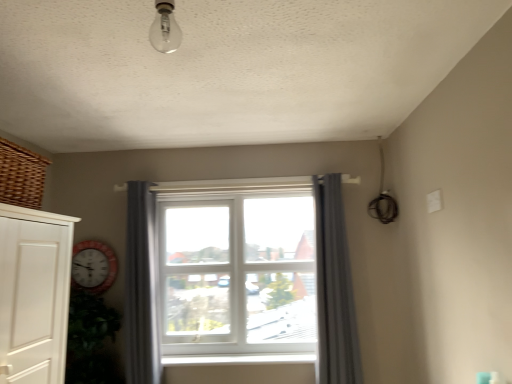
What is the approximate height of white plastic window at center?

3.56 feet.

I want to click on white wooden clock at left, so click(x=93, y=266).

The height and width of the screenshot is (384, 512). What do you see at coordinates (142, 287) in the screenshot? I see `gray fabric curtain at center, which is counted as the first curtain, starting from the left` at bounding box center [142, 287].

What is the approximate height of gray fabric curtain at center, which is counted as the first curtain, starting from the left?

It is 3.90 feet.

Measure the distance between point (15,178) and camera.

Point (15,178) and camera are 1.53 meters apart from each other.

Where is `clear glass bulb at upper center`? This screenshot has height=384, width=512. clear glass bulb at upper center is located at coordinates (165, 28).

In the scene shown: Considering the sizes of objects gray fabric curtain at center, arranged as the 2th curtain when viewed from the left, and white plastic window at center in the image provided, who is wider, gray fabric curtain at center, arranged as the 2th curtain when viewed from the left, or white plastic window at center?

With larger width is white plastic window at center.

From a real-world perspective, between gray fabric curtain at center, arranged as the 2th curtain when viewed from the left, and white plastic window at center, who is vertically higher?

From a 3D spatial view, white plastic window at center is above.

Which is behind, point (318, 372) or point (143, 280)?

The point (143, 280) is farther.

From the picture: Can you confirm if clear glass bulb at upper center is taller than gray fabric curtain at center, arranged as the 2th curtain when viewed from the left?

No.

Can we say clear glass bulb at upper center lies outside gray fabric curtain at center, the first curtain from the right?

clear glass bulb at upper center lies outside gray fabric curtain at center, the first curtain from the right,'s area.

Identify the location of light fixture on the left of gray fabric curtain at center, arranged as the 2th curtain when viewed from the left. Image resolution: width=512 pixels, height=384 pixels. (165, 28).

How many degrees apart are the facing directions of clear glass bulb at upper center and gray fabric curtain at center, the first curtain from the right?

7.7 degrees.

From a real-world perspective, is gray fabric curtain at center, which is counted as the first curtain, starting from the left, located higher than white plastic window sill at center?

Yes, from a real-world perspective, gray fabric curtain at center, which is counted as the first curtain, starting from the left, is on top of white plastic window sill at center.

Is white plastic window sill at center inside gray fabric curtain at center, the second curtain positioned from the right?

No, white plastic window sill at center is not a part of gray fabric curtain at center, the second curtain positioned from the right.

Looking at this image, is gray fabric curtain at center, which is counted as the first curtain, starting from the left, in front of or behind white plastic window sill at center in the image?

gray fabric curtain at center, which is counted as the first curtain, starting from the left, is in front of white plastic window sill at center.

Is gray fabric curtain at center, the second curtain positioned from the right, far away from white plastic window sill at center?

gray fabric curtain at center, the second curtain positioned from the right, is actually quite close to white plastic window sill at center.

Would you say woven brown basket at upper left is part of gray fabric curtain at center, arranged as the 2th curtain when viewed from the left,'s contents?

No, woven brown basket at upper left is not surrounded by gray fabric curtain at center, arranged as the 2th curtain when viewed from the left.

From the image's perspective, is gray fabric curtain at center, the first curtain from the right, over woven brown basket at upper left?

No, from the image's perspective, gray fabric curtain at center, the first curtain from the right, is not over woven brown basket at upper left.

The width and height of the screenshot is (512, 384). I want to click on basket in front of the gray fabric curtain at center, the first curtain from the right, so click(21, 175).

Can you confirm if white plastic window at center is taller than gray fabric curtain at center, the first curtain from the right?

No, white plastic window at center is not taller than gray fabric curtain at center, the first curtain from the right.

Does white plastic window at center have a smaller size compared to gray fabric curtain at center, arranged as the 2th curtain when viewed from the left?

No.

Is gray fabric curtain at center, arranged as the 2th curtain when viewed from the left, at the back of white plastic window at center?

No, gray fabric curtain at center, arranged as the 2th curtain when viewed from the left, is not at the back of white plastic window at center.

Is gray fabric curtain at center, the first curtain from the right, completely or partially inside white plastic window at center?

No.

Is white wooden clock at left at the back of woven brown basket at upper left?

No, white wooden clock at left is not at the back of woven brown basket at upper left.

Would you say woven brown basket at upper left is a long distance from white wooden clock at left?

That's right, there is a large distance between woven brown basket at upper left and white wooden clock at left.

Measure the distance from woven brown basket at upper left to white wooden clock at left.

1.07 meters.

From the image's perspective, which object appears higher, woven brown basket at upper left or white wooden clock at left?

woven brown basket at upper left.

From a real-world perspective, is woven brown basket at upper left above or below gray fabric curtain at center, the first curtain from the right?

Clearly, from a real-world perspective, woven brown basket at upper left is above gray fabric curtain at center, the first curtain from the right.

Consider the image. Can you tell me how much woven brown basket at upper left and gray fabric curtain at center, arranged as the 2th curtain when viewed from the left, differ in facing direction?

The angular difference between woven brown basket at upper left and gray fabric curtain at center, arranged as the 2th curtain when viewed from the left, is 81.3 degrees.

Which point is more forward, (16,198) or (329,225)?

Point (16,198)

Looking at this image, is woven brown basket at upper left not within gray fabric curtain at center, arranged as the 2th curtain when viewed from the left?

That's correct, woven brown basket at upper left is outside of gray fabric curtain at center, arranged as the 2th curtain when viewed from the left.

This screenshot has width=512, height=384. Find the location of `window behind the gray fabric curtain at center, arranged as the 2th curtain when viewed from the left`. window behind the gray fabric curtain at center, arranged as the 2th curtain when viewed from the left is located at coordinates (316, 278).

Where is `curtain on the right of clear glass bulb at upper center`? Image resolution: width=512 pixels, height=384 pixels. curtain on the right of clear glass bulb at upper center is located at coordinates (334, 288).

From the image, which object appears to be farther from white plastic window at center, white plastic window sill at center or clear glass bulb at upper center?

clear glass bulb at upper center.

Considering their positions, is gray fabric curtain at center, arranged as the 2th curtain when viewed from the left, positioned further to white plastic window sill at center than clear glass bulb at upper center?

Among the two, clear glass bulb at upper center is located further to white plastic window sill at center.

Based on their spatial positions, is clear glass bulb at upper center or gray fabric curtain at center, arranged as the 2th curtain when viewed from the left, further from gray fabric curtain at center, the second curtain positioned from the right?

clear glass bulb at upper center is further to gray fabric curtain at center, the second curtain positioned from the right.

Which object lies further to the anchor point gray fabric curtain at center, the first curtain from the right, white plastic window sill at center or white wooden clock at left?

white wooden clock at left.

Looking at the image, which one is located closer to white wooden clock at left, gray fabric curtain at center, the first curtain from the right, or woven brown basket at upper left?

woven brown basket at upper left is positioned closer to the anchor white wooden clock at left.

When comparing their distances from white plastic window sill at center, does white plastic window at center or gray fabric curtain at center, the first curtain from the right, seem further?

gray fabric curtain at center, the first curtain from the right, lies further to white plastic window sill at center than the other object.

Estimate the real-world distances between objects in this image. Which object is closer to gray fabric curtain at center, arranged as the 2th curtain when viewed from the left, white plastic window at center or gray fabric curtain at center, which is counted as the first curtain, starting from the left?

white plastic window at center.

Based on their spatial positions, is white wooden clock at left or woven brown basket at upper left closer to gray fabric curtain at center, arranged as the 2th curtain when viewed from the left?

Based on the image, white wooden clock at left appears to be nearer to gray fabric curtain at center, arranged as the 2th curtain when viewed from the left.

The image size is (512, 384). What are the coordinates of `curtain located between woven brown basket at upper left and gray fabric curtain at center, arranged as the 2th curtain when viewed from the left, in the left-right direction` in the screenshot? It's located at (142, 287).

I want to click on window between white plastic window sill at center and gray fabric curtain at center, the first curtain from the right, from left to right, so click(316, 278).

The width and height of the screenshot is (512, 384). In order to click on window between clear glass bulb at upper center and white plastic window sill at center from front to back in this screenshot , I will do `click(316, 278)`.

Image resolution: width=512 pixels, height=384 pixels. I want to click on window between woven brown basket at upper left and white plastic window sill at center in the front-back direction, so click(x=316, y=278).